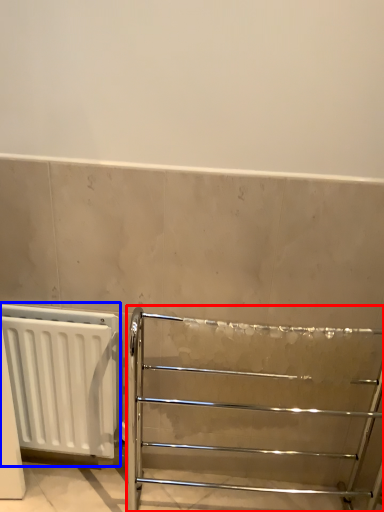
Question: Which object is closer to the camera taking this photo, furniture (highlighted by a red box) or radiator (highlighted by a blue box)?

Choices:
 (A) furniture
 (B) radiator

Answer: (A)